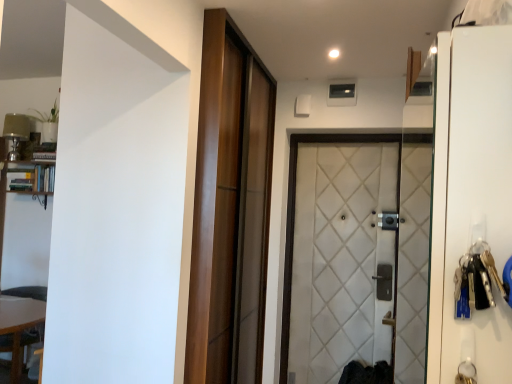
Question: Is wooden sliding door at center, arranged as the 2th door when viewed from the right, not near wooden table at lower left?

Choices:
 (A) yes
 (B) no

Answer: (A)

Question: From the image's perspective, is wooden sliding door at center, arranged as the 2th door when viewed from the right, below wooden table at lower left?

Choices:
 (A) no
 (B) yes

Answer: (A)

Question: Is wooden sliding door at center, arranged as the 2th door when viewed from the right, not inside wooden table at lower left?

Choices:
 (A) no
 (B) yes

Answer: (B)

Question: Is wooden sliding door at center, arranged as the 2th door when viewed from the right, closer to the viewer compared to wooden table at lower left?

Choices:
 (A) no
 (B) yes

Answer: (B)

Question: Is wooden sliding door at center, arranged as the 2th door when viewed from the right, thinner than wooden table at lower left?

Choices:
 (A) no
 (B) yes

Answer: (B)

Question: From a real-world perspective, does wooden sliding door at center, the first door positioned from the left, stand above wooden table at lower left?

Choices:
 (A) no
 (B) yes

Answer: (B)

Question: From a real-world perspective, does wooden sliding door at center, the first door positioned from the left, stand above white glossy screen door at right?

Choices:
 (A) no
 (B) yes

Answer: (A)

Question: Is wooden sliding door at center, the first door positioned from the left, shorter than white glossy screen door at right?

Choices:
 (A) no
 (B) yes

Answer: (A)

Question: From the image's perspective, does wooden sliding door at center, the first door positioned from the left, appear lower than white glossy screen door at right?

Choices:
 (A) yes
 (B) no

Answer: (A)

Question: Does wooden sliding door at center, arranged as the 2th door when viewed from the right, contain white glossy screen door at right?

Choices:
 (A) no
 (B) yes

Answer: (A)

Question: Is wooden sliding door at center, the first door positioned from the left, looking in the opposite direction of white glossy screen door at right?

Choices:
 (A) no
 (B) yes

Answer: (A)

Question: Can you confirm if wooden sliding door at center, arranged as the 2th door when viewed from the right, is taller than white glossy screen door at right?

Choices:
 (A) no
 (B) yes

Answer: (B)

Question: Is white quilted fabric door at center, the 1th door viewed from the right, wider than wooden table at lower left?

Choices:
 (A) yes
 (B) no

Answer: (B)